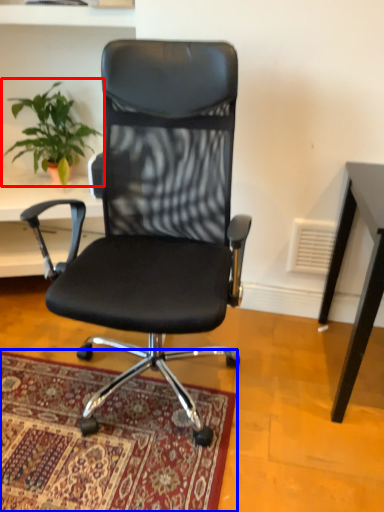
Question: Which object appears closest to the camera in this image, houseplant (highlighted by a red box) or mat (highlighted by a blue box)?

Choices:
 (A) houseplant
 (B) mat

Answer: (B)